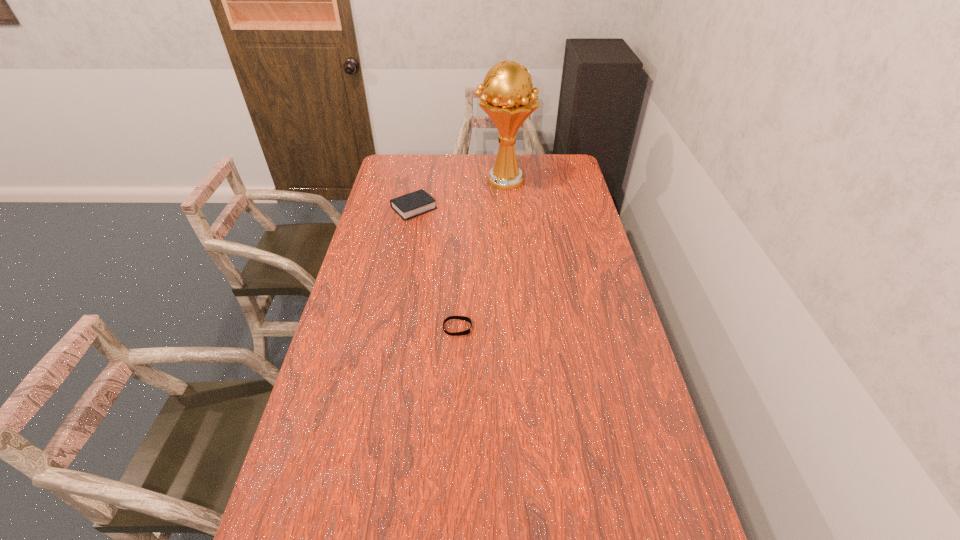
This screenshot has width=960, height=540. Find the location of `vacant space located on the display of the nearest object`. vacant space located on the display of the nearest object is located at coordinates (583, 328).

In order to click on object located in the far edge section of the desktop in this screenshot , I will do `click(507, 100)`.

Locate an element on the screen. object located in the left edge section of the desktop is located at coordinates (410, 205).

The height and width of the screenshot is (540, 960). What are the coordinates of `vacant area at the far edge` in the screenshot? It's located at (536, 155).

Locate an element on the screen. The image size is (960, 540). free space at the left edge is located at coordinates tap(396, 245).

Locate an element on the screen. This screenshot has width=960, height=540. free space at the right edge of the desktop is located at coordinates click(637, 382).

In the image, there is a desktop. Identify the location of vacant space at the far left corner. This screenshot has height=540, width=960. (392, 165).

Identify the location of free point between the trophy_cup and the wristband. (481, 254).

Identify the location of free space that is in between the Bible and the trophy_cup. (459, 194).

Where is `vacant region between the Bible and the tallest object`? The height and width of the screenshot is (540, 960). vacant region between the Bible and the tallest object is located at coordinates (459, 194).